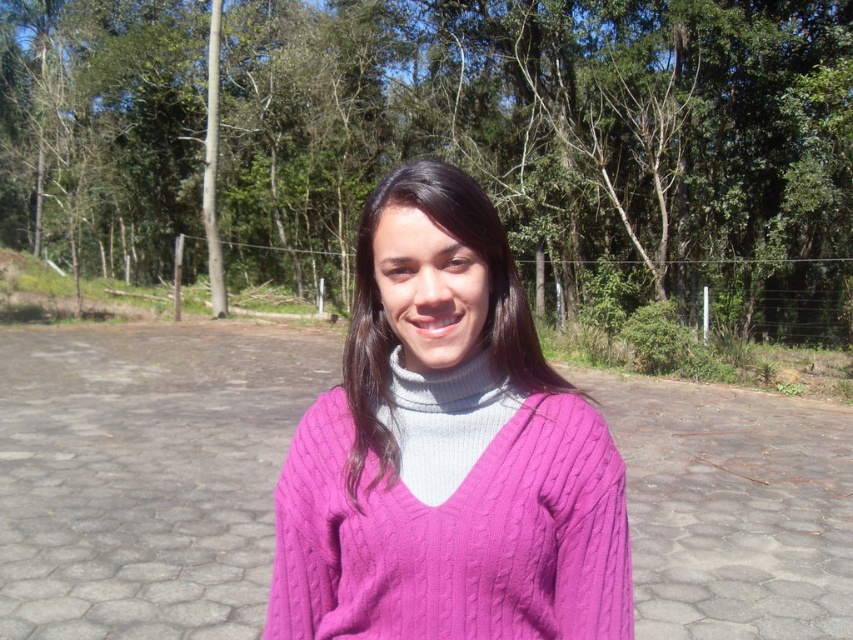
What do you see at coordinates (556, 144) in the screenshot? Image resolution: width=853 pixels, height=640 pixels. I see `green leafy tree at center` at bounding box center [556, 144].

Which is more to the right, green leafy tree at center or cable-knit sweater at center?

Positioned to the right is cable-knit sweater at center.

Describe the element at coordinates (556, 144) in the screenshot. This screenshot has width=853, height=640. I see `green leafy tree at center` at that location.

Where is `green leafy tree at center`? green leafy tree at center is located at coordinates (556, 144).